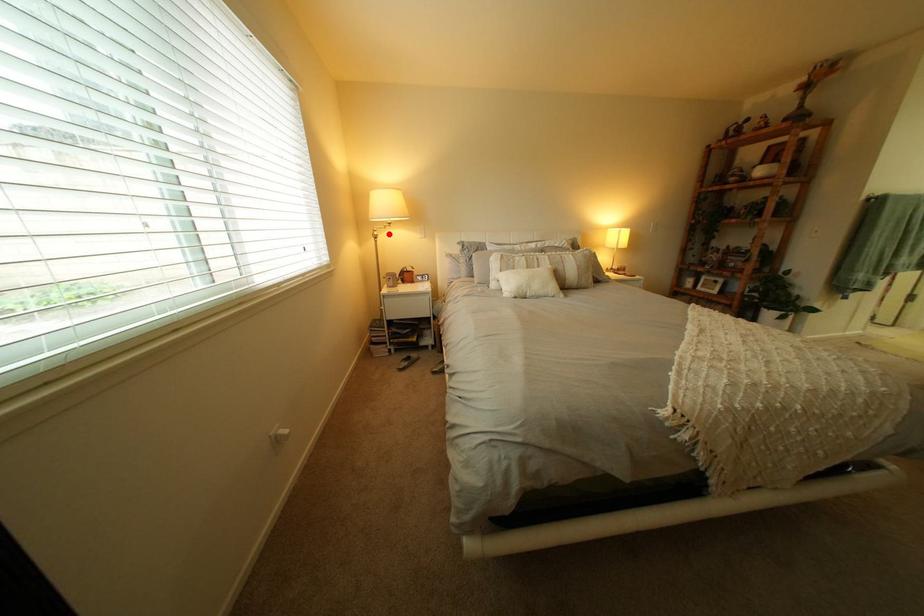
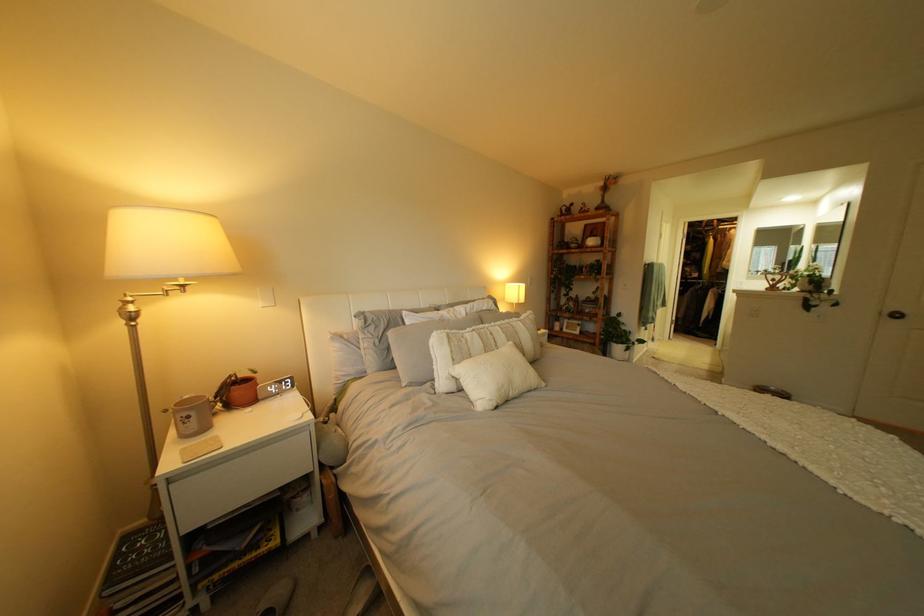
Question: I am providing you with two images of the same scene from different viewpoints. In image1, a red point is highlighted. Considering the same 3D point in image2, which of the following is correct?

Choices:
 (A) It is closer
 (B) It is farther

Answer: (B)